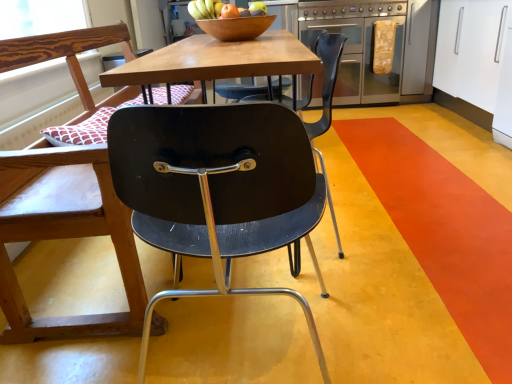
Where is `vacant space to the right of matte black chair at center, the 2th chair from the left`? vacant space to the right of matte black chair at center, the 2th chair from the left is located at coordinates coord(400,305).